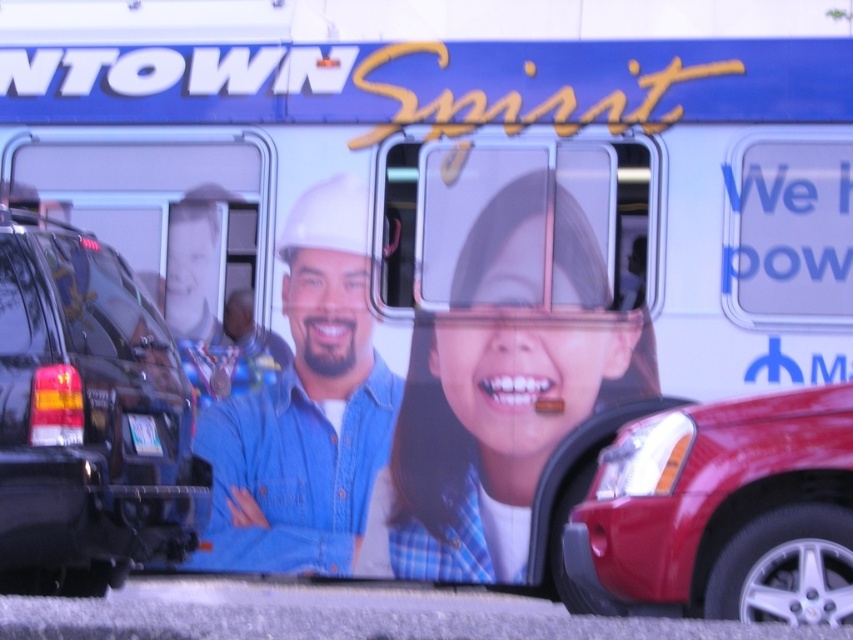
Question: Which object is closer to the camera taking this photo?

Choices:
 (A) shiny black suv at left
 (B) matte blue shirt at center

Answer: (A)

Question: Which object is farther from the camera taking this photo?

Choices:
 (A) white plastic license plate at center
 (B) blue denim shirt at center
 (C) shiny black suv at left
 (D) matte blue shirt at center

Answer: (B)

Question: Which point is farther from the camera taking this photo?

Choices:
 (A) (352, 524)
 (B) (660, 529)
 (C) (91, 481)

Answer: (A)

Question: Is shiny red car at right to the right of white plastic license plate at center from the viewer's perspective?

Choices:
 (A) yes
 (B) no

Answer: (A)

Question: Is matte blue shirt at center positioned behind blue denim shirt at center?

Choices:
 (A) no
 (B) yes

Answer: (A)

Question: Is shiny red car at right in front of blue denim shirt at center?

Choices:
 (A) yes
 (B) no

Answer: (A)